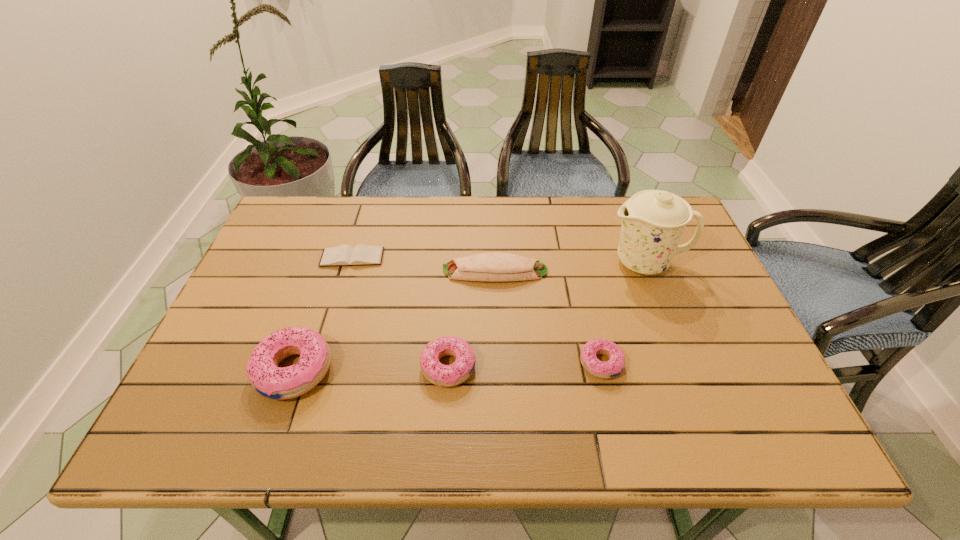
Identify the location of object present at the left edge. (279, 383).

Image resolution: width=960 pixels, height=540 pixels. Identify the location of object that is at the right edge. (653, 223).

I want to click on object positioned at the near left corner, so click(x=279, y=383).

Where is `blank space at the far edge of the desktop`? The height and width of the screenshot is (540, 960). blank space at the far edge of the desktop is located at coordinates (564, 229).

Where is `free spot at the near edge of the desktop`? The height and width of the screenshot is (540, 960). free spot at the near edge of the desktop is located at coordinates (518, 389).

Locate an element on the screen. The height and width of the screenshot is (540, 960). vacant space at the left edge is located at coordinates (248, 300).

At what (x,y) coordinates should I click in order to perform the action: click on vacant area at the right edge of the desktop. Please return your answer as a coordinate pair (x, y). Image resolution: width=960 pixels, height=540 pixels. Looking at the image, I should click on (719, 322).

Find the location of `vacant region at the far left corner of the desktop`. vacant region at the far left corner of the desktop is located at coordinates (311, 211).

At what (x,y) coordinates should I click in order to perform the action: click on vacant space at the near left corner of the desktop. Please return your answer as a coordinate pair (x, y). Looking at the image, I should click on (203, 392).

The width and height of the screenshot is (960, 540). In order to click on vacant area that lies between the diary and the tallest doughnut in this screenshot , I will do `click(324, 314)`.